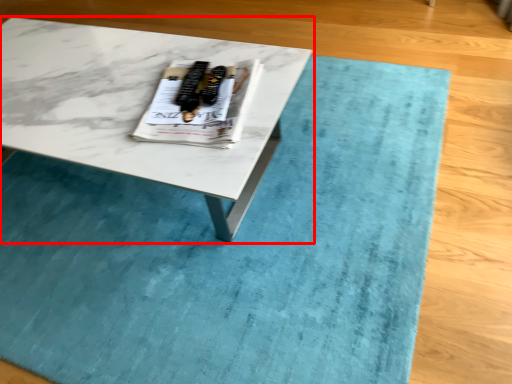
Question: From the image's perspective, what is the correct spatial relationship of coffee table (annotated by the red box) in relation to magazine?

Choices:
 (A) below
 (B) above

Answer: (A)